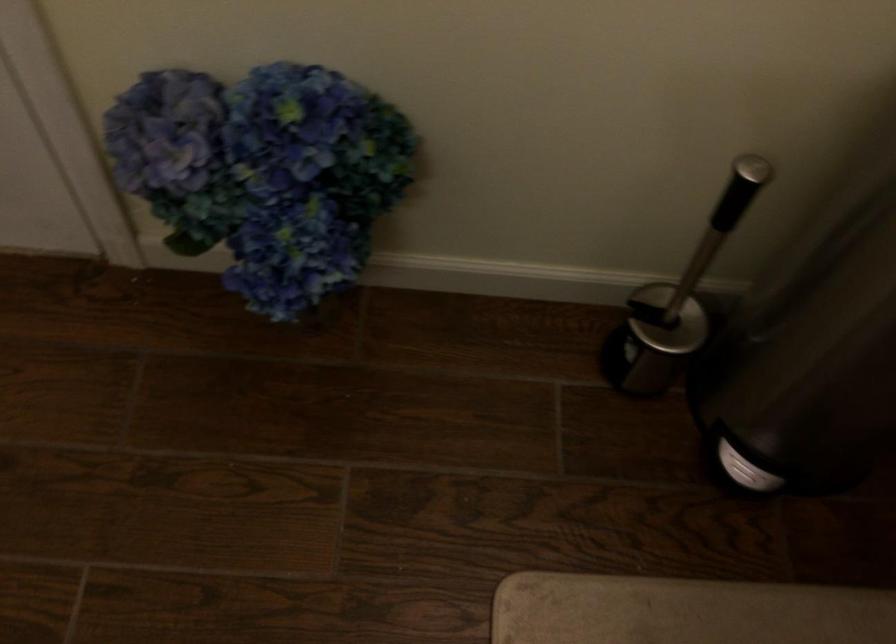
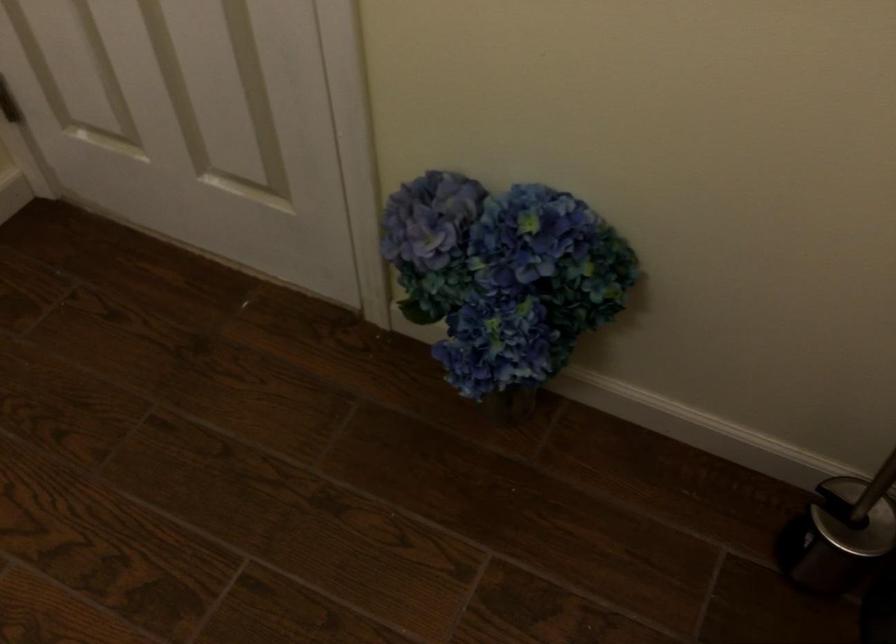
Question: The images are taken continuously from a first-person perspective. In which direction is your viewpoint rotating?

Choices:
 (A) Left
 (B) Right
 (C) Up
 (D) Down

Answer: (A)